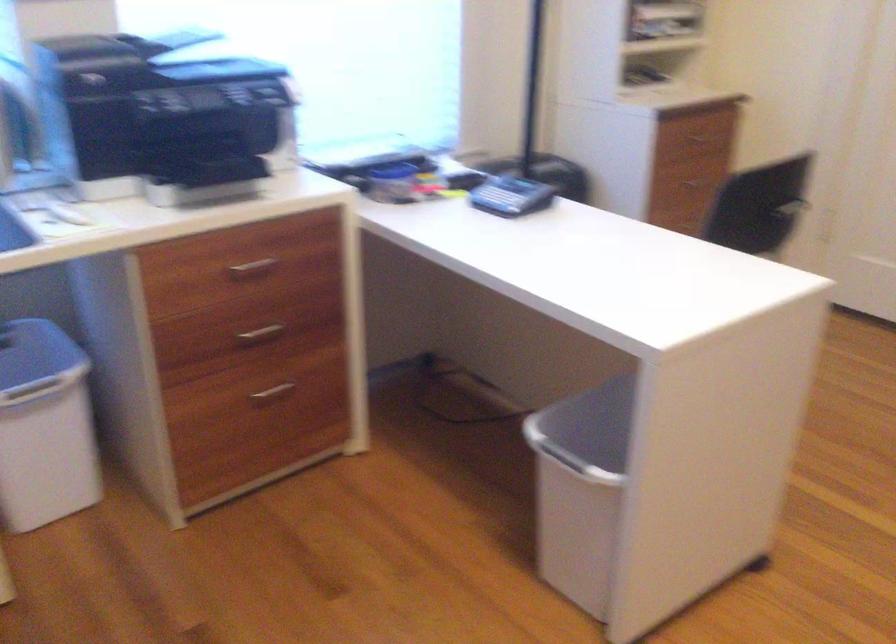
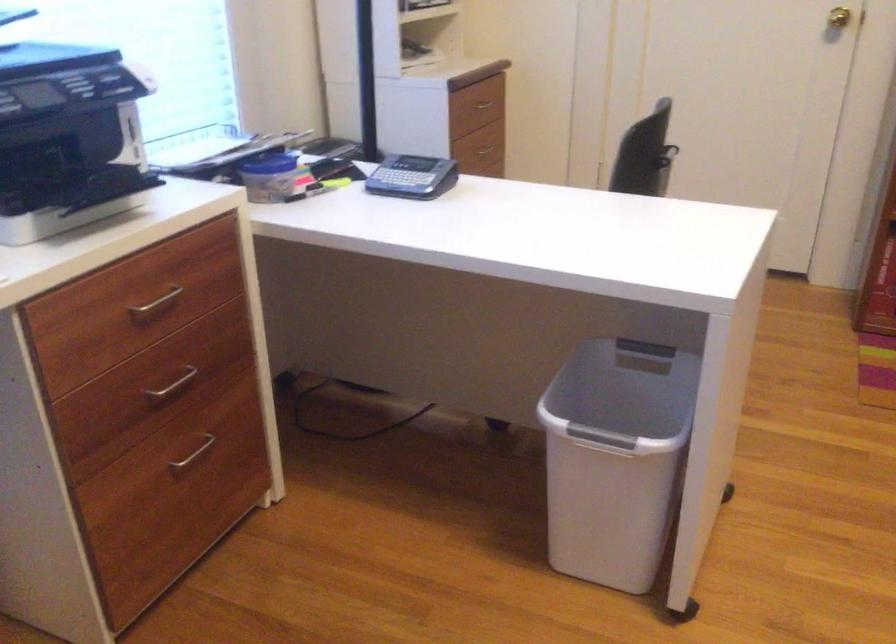
Locate, in the second image, the point that corresponds to point 259,332 in the first image.

(173, 384)